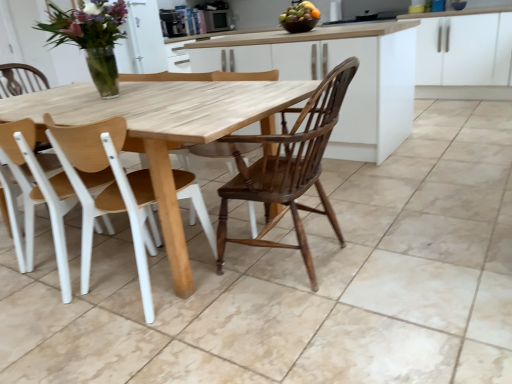
Identify the location of free spot to the left of wooden at center, the 1th chair when ordered from right to left. The height and width of the screenshot is (384, 512). (39, 313).